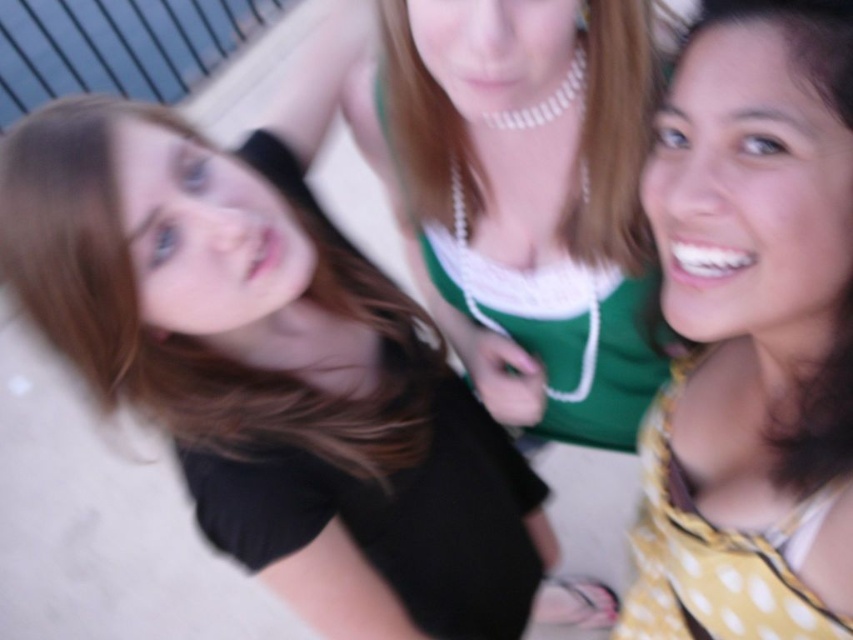
Question: Can you confirm if black matte dress at lower left is wider than metallic blue balustrade at upper left?

Choices:
 (A) no
 (B) yes

Answer: (A)

Question: Which object appears closest to the camera in this image?

Choices:
 (A) metallic blue balustrade at upper left
 (B) yellow dotted fabric at lower right
 (C) black matte shirt at upper left
 (D) yellow dotted scarf at lower right

Answer: (D)

Question: Which object appears closest to the camera in this image?

Choices:
 (A) yellow dotted fabric at lower right
 (B) black matte dress at lower left
 (C) black matte shirt at upper left

Answer: (C)

Question: Is the position of yellow dotted fabric at lower right less distant than that of metallic blue balustrade at upper left?

Choices:
 (A) yes
 (B) no

Answer: (A)

Question: Which of these objects is positioned farthest from the metallic blue balustrade at upper left?

Choices:
 (A) yellow dotted fabric at lower right
 (B) yellow dotted scarf at lower right
 (C) black matte dress at lower left

Answer: (B)

Question: From the image, what is the correct spatial relationship of black matte shirt at upper left in relation to metallic blue balustrade at upper left?

Choices:
 (A) right
 (B) left

Answer: (A)